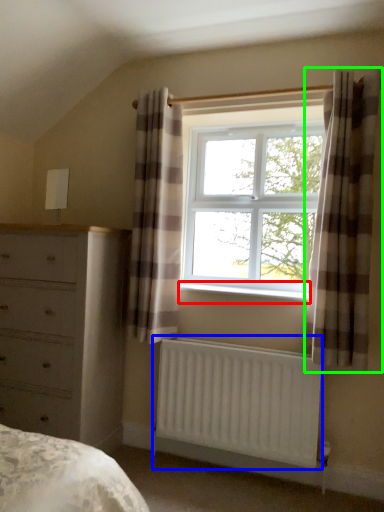
Question: Estimate the real-world distances between objects in this image. Which object is closer to window sill (highlighted by a red box), radiator (highlighted by a blue box) or curtain (highlighted by a green box)?

Choices:
 (A) radiator
 (B) curtain

Answer: (B)